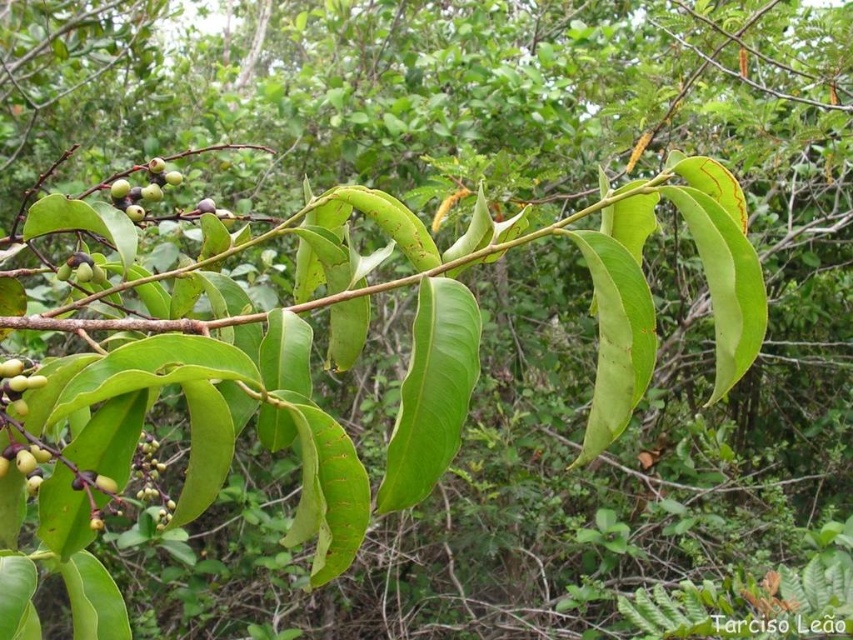
Question: Can you confirm if green matte berries at upper left is smaller than green matte fruit at lower left?

Choices:
 (A) no
 (B) yes

Answer: (A)

Question: Considering the real-world distances, which object is farthest from the green matte berries at upper left?

Choices:
 (A) green matte berry at center-left
 (B) green glossy leaves at center
 (C) green matte fruit at lower left

Answer: (C)

Question: Among these points, which one is nearest to the camera?

Choices:
 (A) (109, 292)
 (B) (15, 376)
 (C) (68, 266)
 (D) (167, 180)

Answer: (B)

Question: Among these objects, which one is nearest to the camera?

Choices:
 (A) green glossy leaves at center
 (B) green matte berries at upper left
 (C) green matte fruit at lower left
 (D) green matte berry at center-left

Answer: (A)

Question: In this image, where is green matte fruit at lower left located relative to green matte berry at center-left?

Choices:
 (A) right
 (B) left

Answer: (A)

Question: In this image, where is green matte berries at upper left located relative to green matte berry at center-left?

Choices:
 (A) above
 (B) below

Answer: (A)